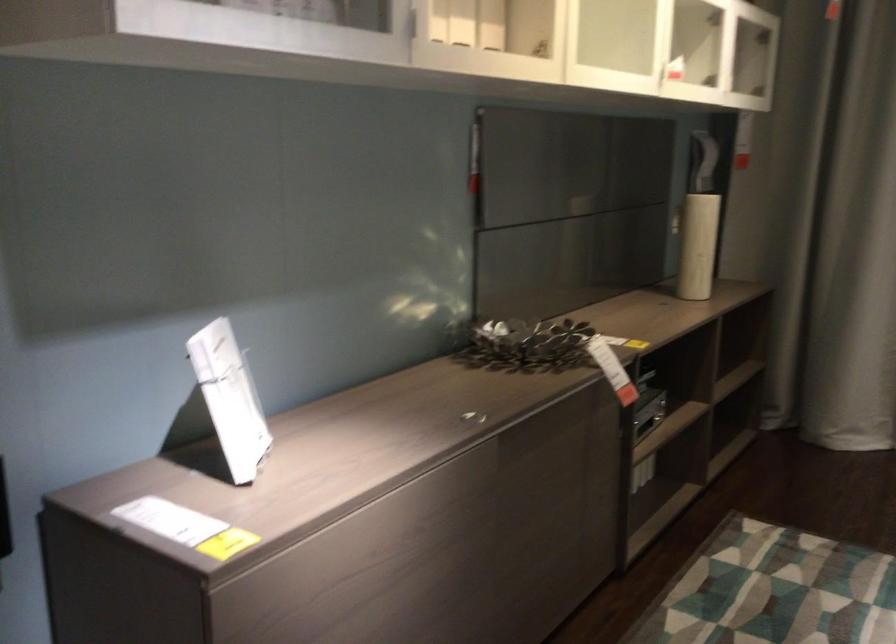
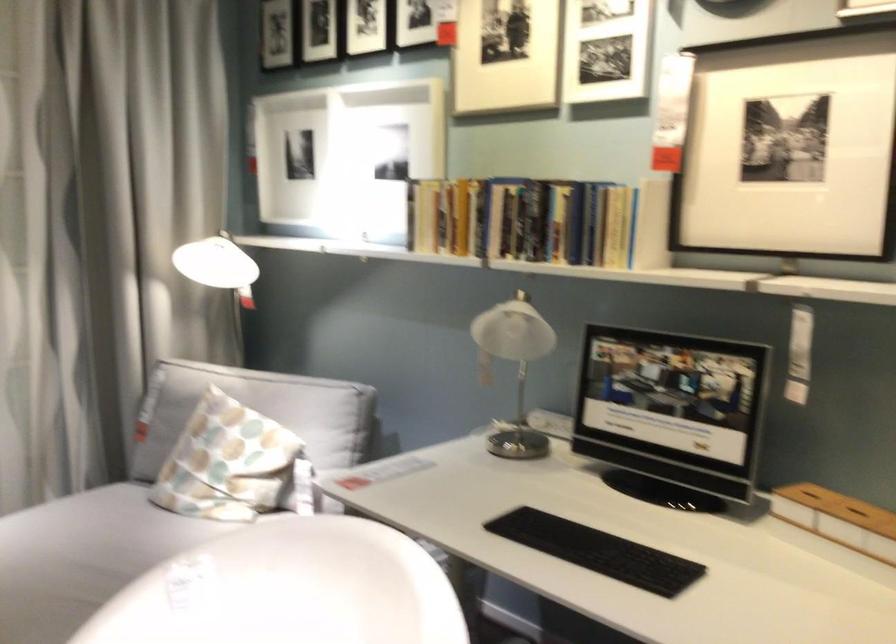
Question: The camera is either moving clockwise (left) or counter-clockwise (right) around the object. The first image is from the beginning of the video and the second image is from the end. Is the camera moving left or right when shooting the video?

Choices:
 (A) Left
 (B) Right

Answer: (A)